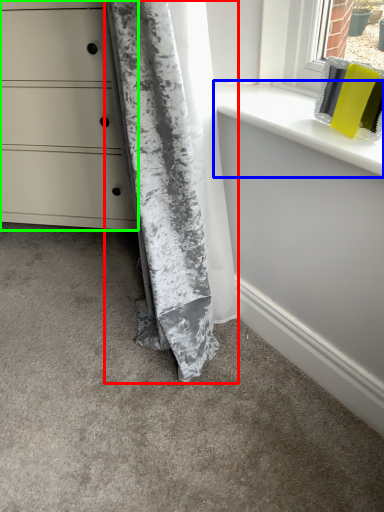
Question: Based on their relative distances, which object is nearer to curtain (highlighted by a red box)? Choose from window sill (highlighted by a blue box) and chest of drawers (highlighted by a green box).

Choices:
 (A) window sill
 (B) chest of drawers

Answer: (A)